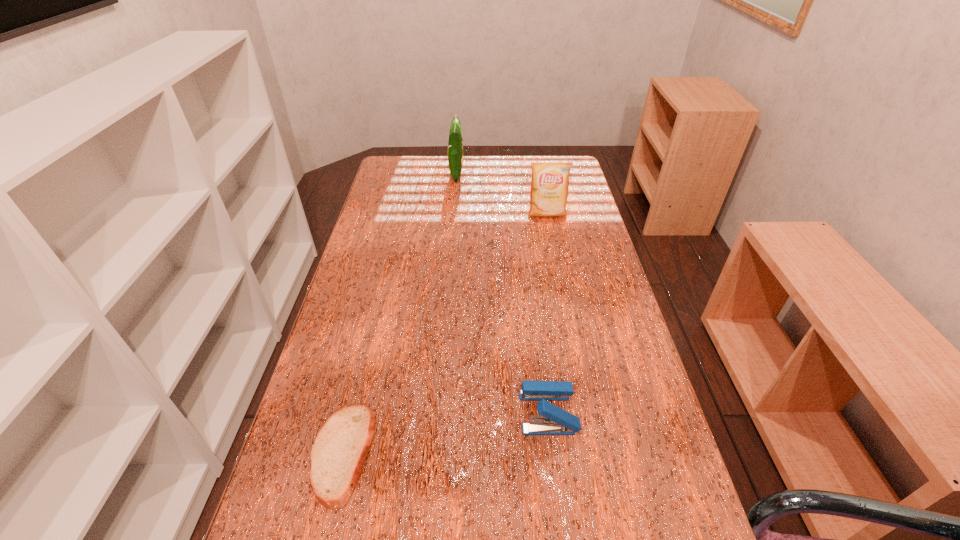
This screenshot has width=960, height=540. Find the location of `free space between the second shortest object and the left crisp (potato chip)`. free space between the second shortest object and the left crisp (potato chip) is located at coordinates (502, 293).

This screenshot has height=540, width=960. In order to click on vacant space that is in between the third object from right to left and the leftmost object in this screenshot , I will do `click(399, 314)`.

Locate an element on the screen. free space between the third nearest object and the stapler is located at coordinates (547, 313).

I want to click on vacant point located between the farthest object and the pita bread, so click(x=399, y=314).

The width and height of the screenshot is (960, 540). In order to click on free space between the third tallest object and the pita bread in this screenshot , I will do `click(445, 433)`.

The image size is (960, 540). What are the coordinates of `vacant point located between the third nearest object and the second shortest object` in the screenshot? It's located at (547, 313).

The image size is (960, 540). Identify the location of vacant point located between the third tallest object and the pita bread. (445, 433).

Where is `free space between the right crisp (potato chip) and the stapler`? The height and width of the screenshot is (540, 960). free space between the right crisp (potato chip) and the stapler is located at coordinates (547, 313).

You are a GUI agent. You are given a task and a screenshot of the screen. Output one action in this format:
    pyautogui.click(x=<x>, y=<y>)
    Task: Click on the empty space between the third tallest object and the farthest object
    The width and height of the screenshot is (960, 540).
    Given the screenshot: What is the action you would take?
    pyautogui.click(x=502, y=293)

Select which object appears as the closest to the third tallest object. Please provide its 2D coordinates. Your answer should be formatted as a tuple, i.e. [(x, y)], where the tuple contains the x and y coordinates of a point satisfying the conditions above.

[(339, 451)]